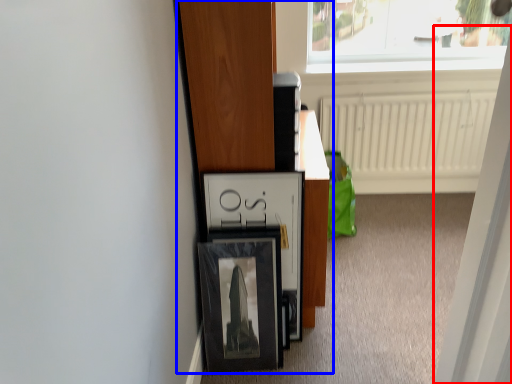
Question: Which object appears farthest to the camera in this image, screen door (highlighted by a red box) or furniture (highlighted by a blue box)?

Choices:
 (A) screen door
 (B) furniture

Answer: (B)